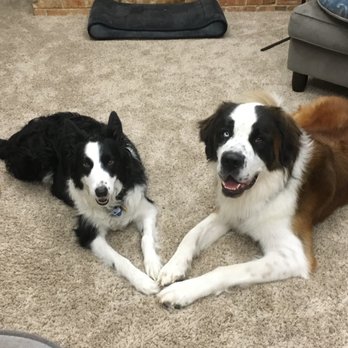
Locate an element on the screen. Image resolution: width=348 pixels, height=348 pixels. chair is located at coordinates (325, 52).